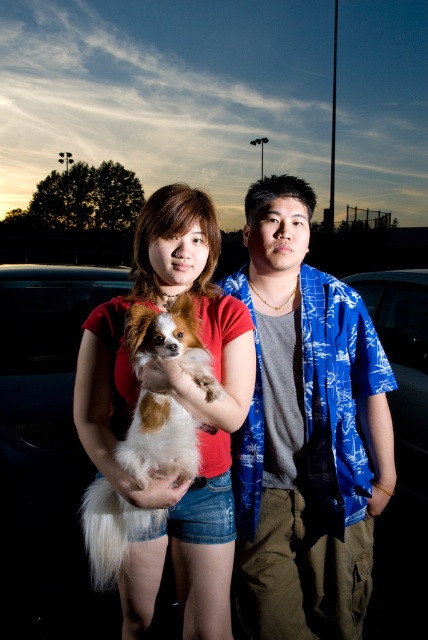
Is blue printed shirt at center taller than white fluffy dog at center?

Indeed, blue printed shirt at center has a greater height compared to white fluffy dog at center.

Does blue printed shirt at center have a greater width compared to white fluffy dog at center?

Indeed, blue printed shirt at center has a greater width compared to white fluffy dog at center.

Where is `blue printed shirt at center`? This screenshot has width=428, height=640. blue printed shirt at center is located at coordinates (306, 433).